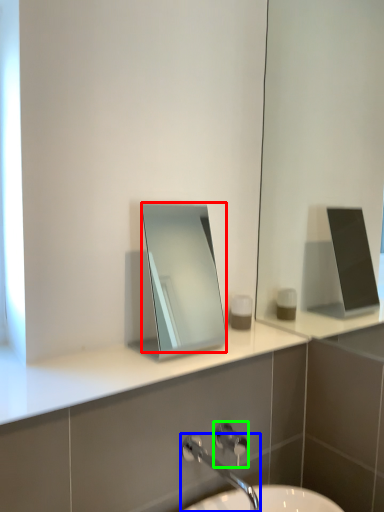
Question: Estimate the real-world distances between objects in this image. Which object is farther from mirror (highlighted by a red box), tap (highlighted by a blue box) or shower (highlighted by a green box)?

Choices:
 (A) tap
 (B) shower

Answer: (B)